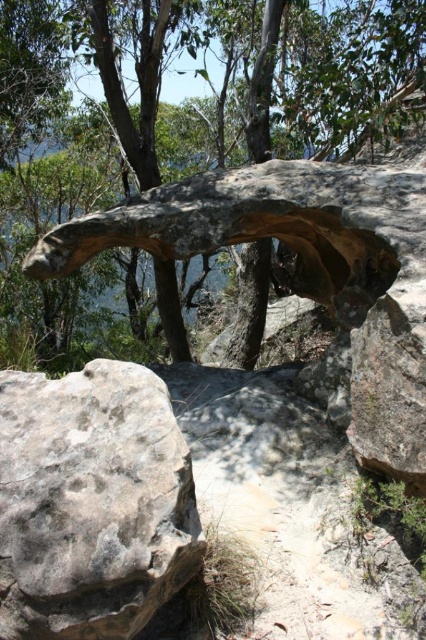
Question: Based on their relative distances, which object is nearer to the brown rough tree trunk at center?

Choices:
 (A) brown rough rock at center
 (B) gray rough rock at lower left

Answer: (A)

Question: Is brown rough rock at center below brown rough tree trunk at center?

Choices:
 (A) no
 (B) yes

Answer: (A)

Question: Which of these objects is positioned closest to the brown rough tree trunk at center?

Choices:
 (A) brown rough rock at center
 (B) gray rough rock at lower left

Answer: (A)

Question: Estimate the real-world distances between objects in this image. Which object is farther from the gray rough rock at lower left?

Choices:
 (A) brown rough rock at center
 (B) brown rough tree trunk at center

Answer: (A)

Question: Does brown rough rock at center come in front of gray rough rock at lower left?

Choices:
 (A) no
 (B) yes

Answer: (A)

Question: Does brown rough rock at center have a lesser width compared to gray rough rock at lower left?

Choices:
 (A) no
 (B) yes

Answer: (A)